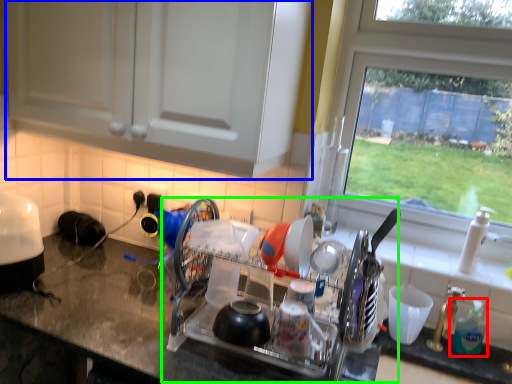
Question: Estimate the real-world distances between objects in this image. Which object is closer to soap dispenser (highlighted by a red box), cabinetry (highlighted by a blue box) or dish washer (highlighted by a green box)?

Choices:
 (A) cabinetry
 (B) dish washer

Answer: (B)